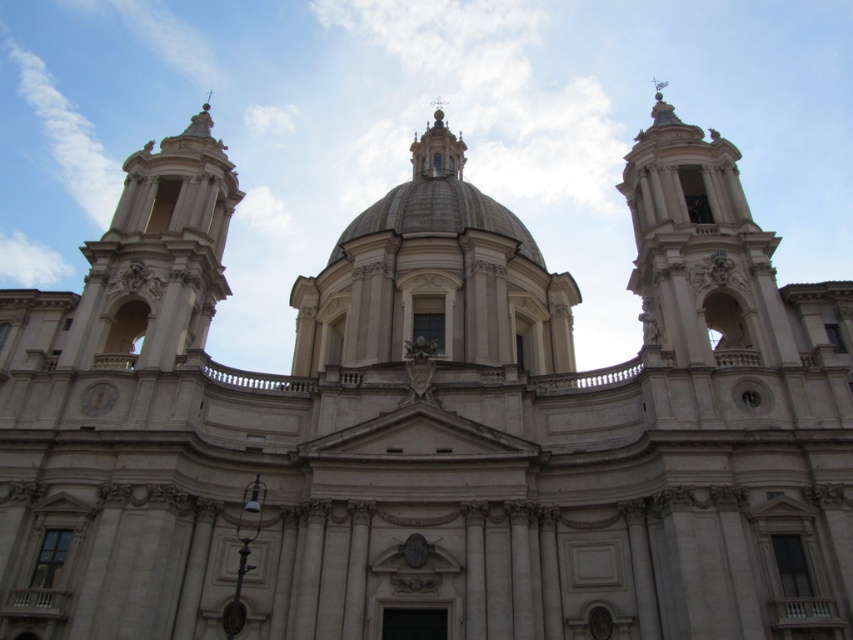
Which is behind, point (140, 248) or point (93, 397)?

The point (140, 248) is more distant.

Is white stone tower at left positioned behind white marble clock at lower left?

Yes, it is behind white marble clock at lower left.

Locate an element on the screen. The width and height of the screenshot is (853, 640). white stone tower at left is located at coordinates (158, 253).

Does white marble dome at center have a smaller size compared to white marble clock at lower left?

No, white marble dome at center is not smaller than white marble clock at lower left.

Is point (440, 180) positioned before point (109, 401)?

No, (440, 180) is further to viewer.

The width and height of the screenshot is (853, 640). Find the location of `white marble dome at center`. white marble dome at center is located at coordinates click(437, 200).

Which of these two, white stone tower at left or white marble dome at center, stands taller?

With more height is white marble dome at center.

Does white stone tower at left have a larger size compared to white marble dome at center?

No.

Which is behind, point (132, 189) or point (410, 148)?

The point (410, 148) is behind.

This screenshot has width=853, height=640. I want to click on white stone tower at left, so click(158, 253).